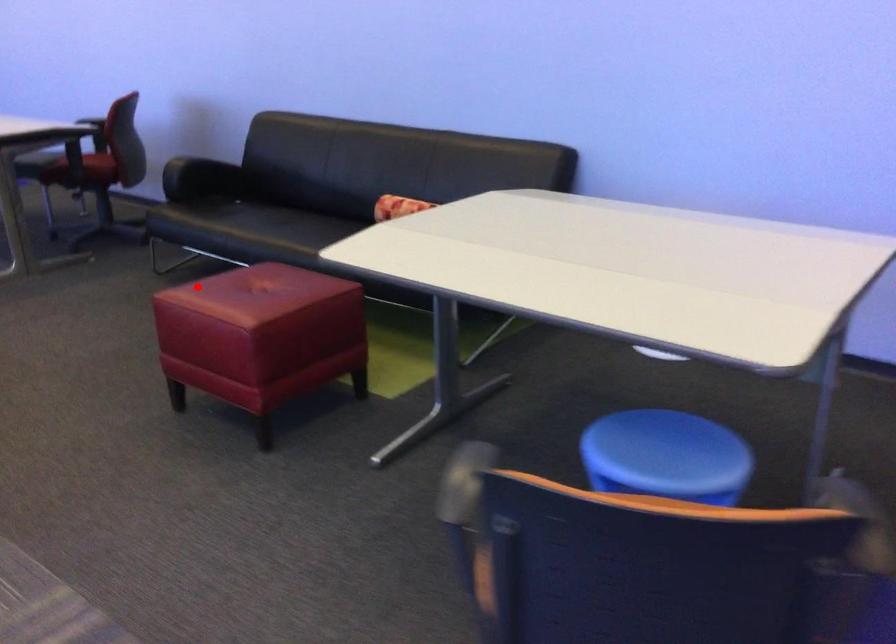
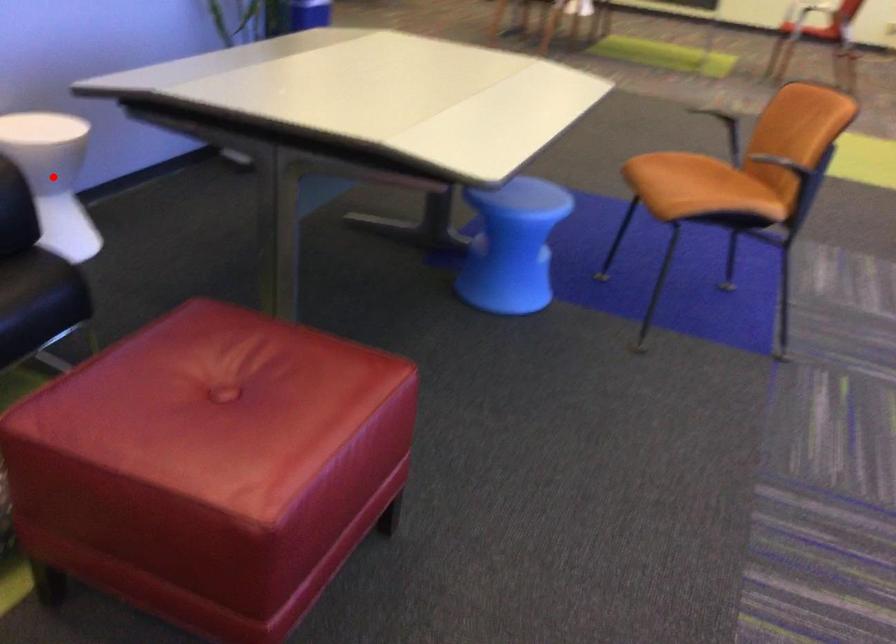
I am providing you with two images of the same scene from different viewpoints. A red point is marked on the first image and another point is marked on the second image. Are the points marked in image1 and image2 representing the same 3D position?

No